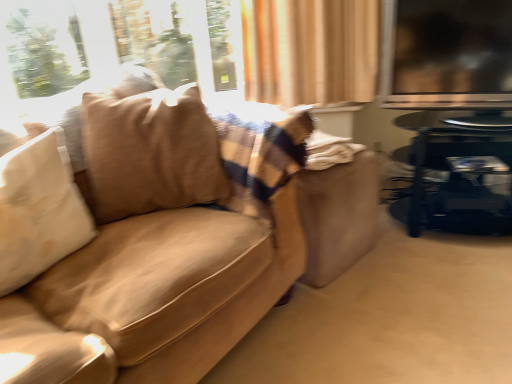
Question: Is transparent glass window screen at upper right touching suede-like beige couch at left?

Choices:
 (A) no
 (B) yes

Answer: (A)

Question: From the image's perspective, does transparent glass window screen at upper right appear lower than suede-like beige couch at left?

Choices:
 (A) yes
 (B) no

Answer: (B)

Question: Does transparent glass window screen at upper right have a lesser width compared to suede-like beige couch at left?

Choices:
 (A) yes
 (B) no

Answer: (A)

Question: Is transparent glass window screen at upper right wider than suede-like beige couch at left?

Choices:
 (A) no
 (B) yes

Answer: (A)

Question: Does transparent glass window screen at upper right have a greater height compared to suede-like beige couch at left?

Choices:
 (A) yes
 (B) no

Answer: (B)

Question: Are transparent glass window screen at upper right and suede-like beige couch at left located far from each other?

Choices:
 (A) no
 (B) yes

Answer: (A)

Question: From the image's perspective, is suede-like beige couch at left above shiny black table at right?

Choices:
 (A) yes
 (B) no

Answer: (B)

Question: Can you confirm if suede-like beige couch at left is wider than shiny black table at right?

Choices:
 (A) no
 (B) yes

Answer: (B)

Question: Considering the relative positions of suede-like beige couch at left and shiny black table at right in the image provided, is suede-like beige couch at left in front of shiny black table at right?

Choices:
 (A) yes
 (B) no

Answer: (A)

Question: Does suede-like beige couch at left have a lesser height compared to shiny black table at right?

Choices:
 (A) yes
 (B) no

Answer: (B)

Question: Is suede-like beige couch at left next to shiny black table at right and touching it?

Choices:
 (A) yes
 (B) no

Answer: (B)

Question: Is suede-like beige couch at left not close to shiny black table at right?

Choices:
 (A) no
 (B) yes

Answer: (A)

Question: Is brown textured pillow at left bigger than shiny black table at right?

Choices:
 (A) yes
 (B) no

Answer: (B)